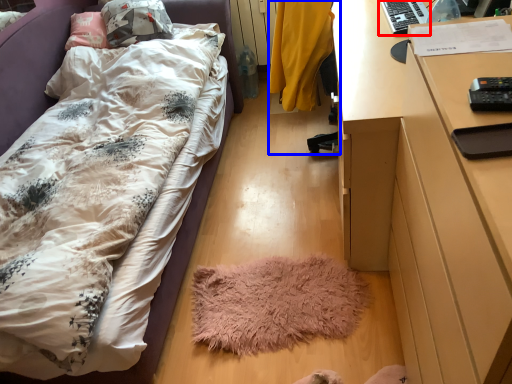
Question: Which of the following is the farthest to the observer, desktop (highlighted by a red box) or chair (highlighted by a blue box)?

Choices:
 (A) desktop
 (B) chair

Answer: (A)